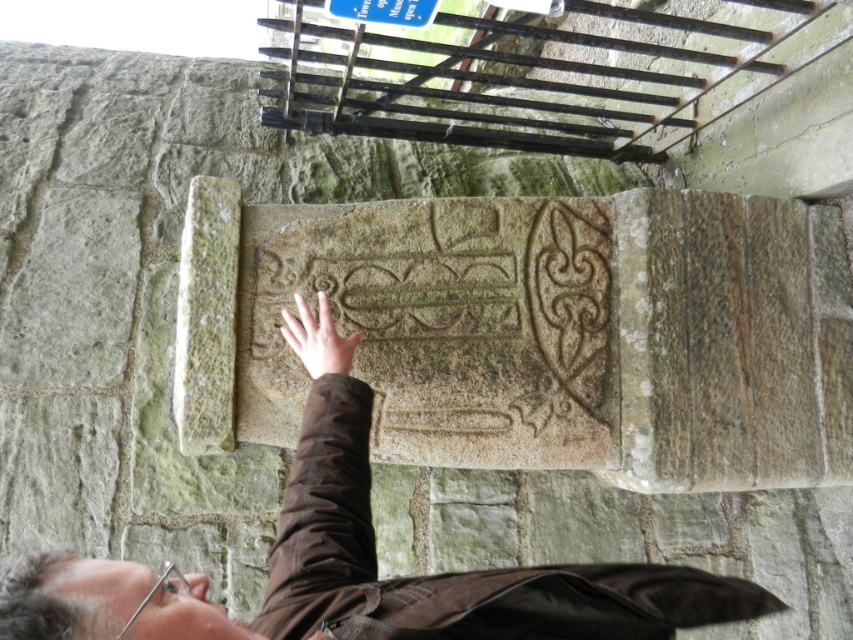
Question: Can you confirm if smooth skin hand at center is positioned to the right of blue plastic sign at upper center?

Choices:
 (A) yes
 (B) no

Answer: (B)

Question: Which object is farther from the camera taking this photo?

Choices:
 (A) smooth skin hand at center
 (B) brown leather jacket at center

Answer: (A)

Question: Based on their relative distances, which object is farther from the smooth skin hand at center?

Choices:
 (A) blue plastic sign at upper center
 (B) brown leather jacket at center

Answer: (A)

Question: Can you confirm if brown leather jacket at center is wider than blue plastic sign at upper center?

Choices:
 (A) yes
 (B) no

Answer: (A)

Question: Is brown leather jacket at center positioned at the back of smooth skin hand at center?

Choices:
 (A) yes
 (B) no

Answer: (B)

Question: Which of the following is the farthest from the observer?

Choices:
 (A) brown leather jacket at center
 (B) blue plastic sign at upper center

Answer: (B)